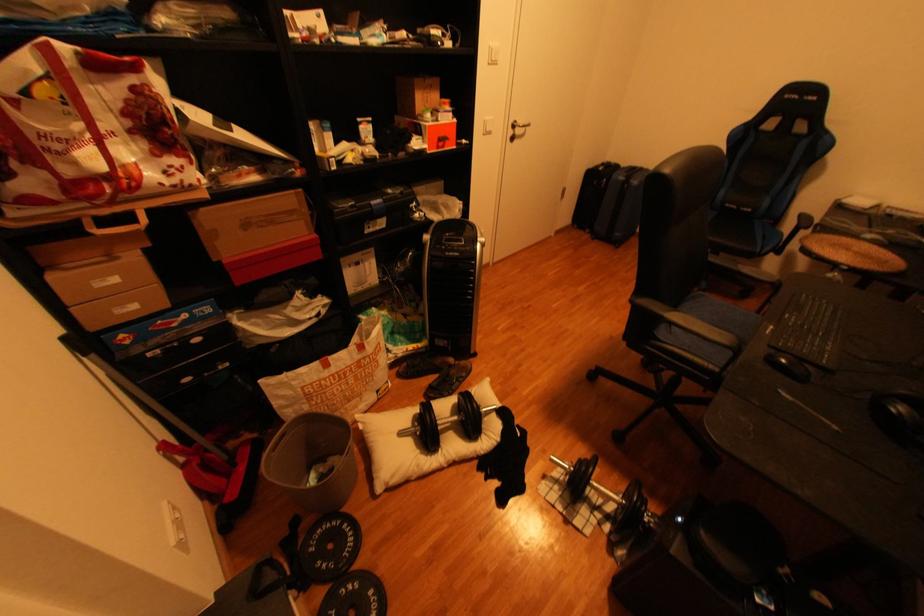
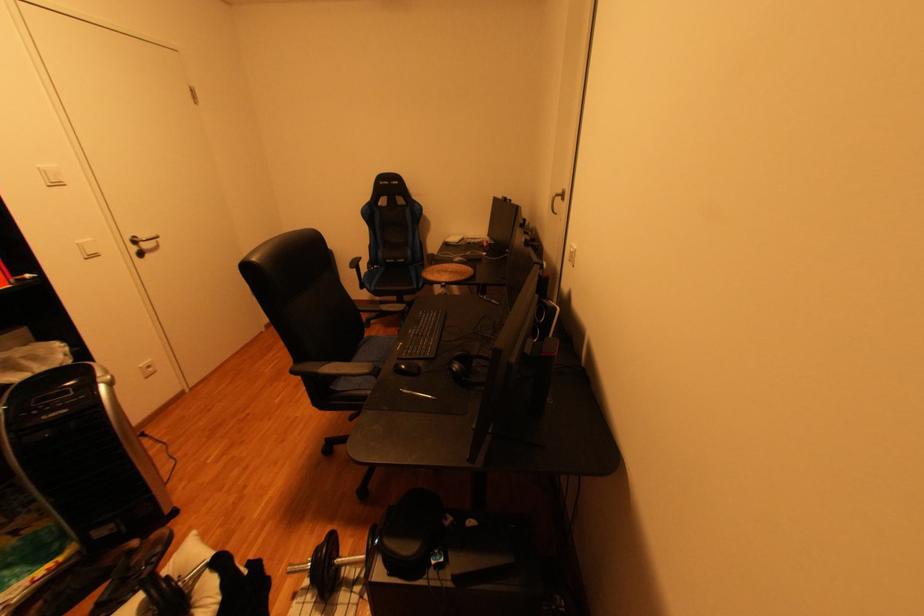
The point at (x=672, y=317) is marked in the first image. Where is the corresponding point in the second image?

(325, 375)